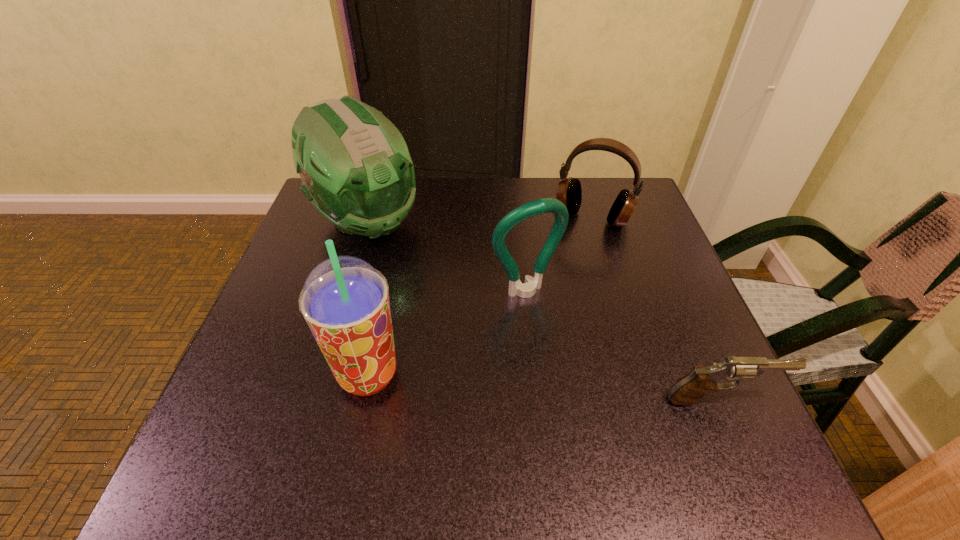
In order to click on vacant space at the near left corner in this screenshot , I will do `click(290, 390)`.

Find the location of a particular element. This screenshot has height=540, width=960. free spot at the far right corner of the desktop is located at coordinates (604, 186).

What are the coordinates of `blank region between the smoothie and the shortest object` in the screenshot? It's located at (544, 387).

You are a GUI agent. You are given a task and a screenshot of the screen. Output one action in this format:
    pyautogui.click(x=<x>, y=<y>)
    Task: Click on the vacant area that lies between the shortest object and the third object from right to left
    The height and width of the screenshot is (540, 960).
    Given the screenshot: What is the action you would take?
    pyautogui.click(x=622, y=345)

This screenshot has width=960, height=540. Find the location of `vacant space that is in between the pistol and the fourth tallest object`. vacant space that is in between the pistol and the fourth tallest object is located at coordinates (657, 308).

At what (x,y) coordinates should I click in order to perform the action: click on free spot between the football helmet and the headset. Please return your answer as a coordinate pair (x, y). The image size is (960, 540). Looking at the image, I should click on (479, 220).

What are the coordinates of `vacant space that is in between the football helmet and the headset` in the screenshot? It's located at (479, 220).

At what (x,y) coordinates should I click in order to perform the action: click on free area in between the second shortest object and the smoothie. Please return your answer as a coordinate pair (x, y). Looking at the image, I should click on (480, 296).

At what (x,y) coordinates should I click in order to perform the action: click on free space between the smoothie and the headset. Please return your answer as a coordinate pair (x, y). The width and height of the screenshot is (960, 540). Looking at the image, I should click on (480, 296).

Find the location of a particular element. free space between the fourth tallest object and the pistol is located at coordinates (657, 308).